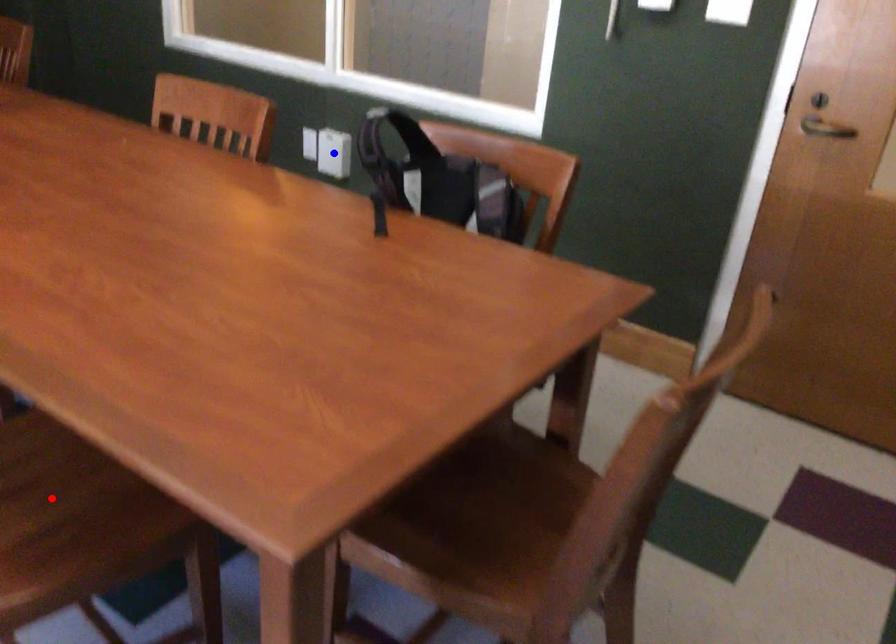
Question: In the image, two points are highlighted. Which point is nearer to the camera? Reply with the corresponding letter.

Choices:
 (A) blue point
 (B) red point

Answer: (B)